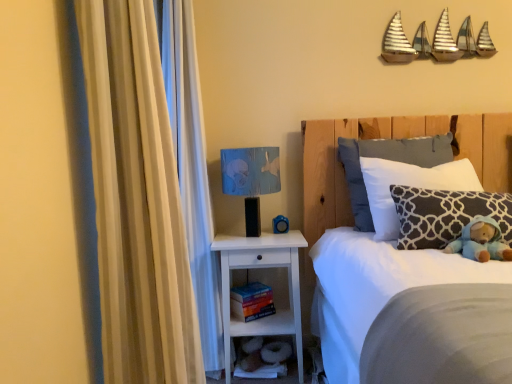
Question: Does blue fabric lampshade at upper right have a lesser width compared to white fabric pillow at upper right, the 1th pillow from the back?

Choices:
 (A) no
 (B) yes

Answer: (A)

Question: Is blue fabric lampshade at upper right further to the viewer compared to white fabric pillow at upper right, which is counted as the third pillow, starting from the front?

Choices:
 (A) yes
 (B) no

Answer: (A)

Question: Is blue fabric lampshade at upper right located outside white fabric pillow at upper right, which is counted as the third pillow, starting from the front?

Choices:
 (A) no
 (B) yes

Answer: (B)

Question: Is white fabric pillow at upper right, which is counted as the third pillow, starting from the front, completely or partially inside blue fabric lampshade at upper right?

Choices:
 (A) yes
 (B) no

Answer: (B)

Question: Can you confirm if blue fabric lampshade at upper right is wider than white fabric pillow at upper right, which is counted as the third pillow, starting from the front?

Choices:
 (A) no
 (B) yes

Answer: (B)

Question: Is blue fabric lampshade at upper right far from white fabric pillow at upper right, which is counted as the third pillow, starting from the front?

Choices:
 (A) no
 (B) yes

Answer: (A)

Question: Is blue rubber duck at lower center surrounded by blue fabric lampshade at upper right?

Choices:
 (A) no
 (B) yes

Answer: (B)

Question: From the image's perspective, is blue fabric lampshade at upper right on blue rubber duck at lower center?

Choices:
 (A) yes
 (B) no

Answer: (A)

Question: Can you confirm if blue fabric lampshade at upper right is thinner than blue rubber duck at lower center?

Choices:
 (A) yes
 (B) no

Answer: (B)

Question: Could you tell me if blue fabric lampshade at upper right is facing blue rubber duck at lower center?

Choices:
 (A) yes
 (B) no

Answer: (B)

Question: Can you confirm if blue fabric lampshade at upper right is wider than blue rubber duck at lower center?

Choices:
 (A) no
 (B) yes

Answer: (B)

Question: Is blue fabric lampshade at upper right closer to camera compared to blue rubber duck at lower center?

Choices:
 (A) no
 (B) yes

Answer: (B)

Question: Is white wood nightstand at lower center outside beige fabric curtain at left?

Choices:
 (A) no
 (B) yes

Answer: (B)